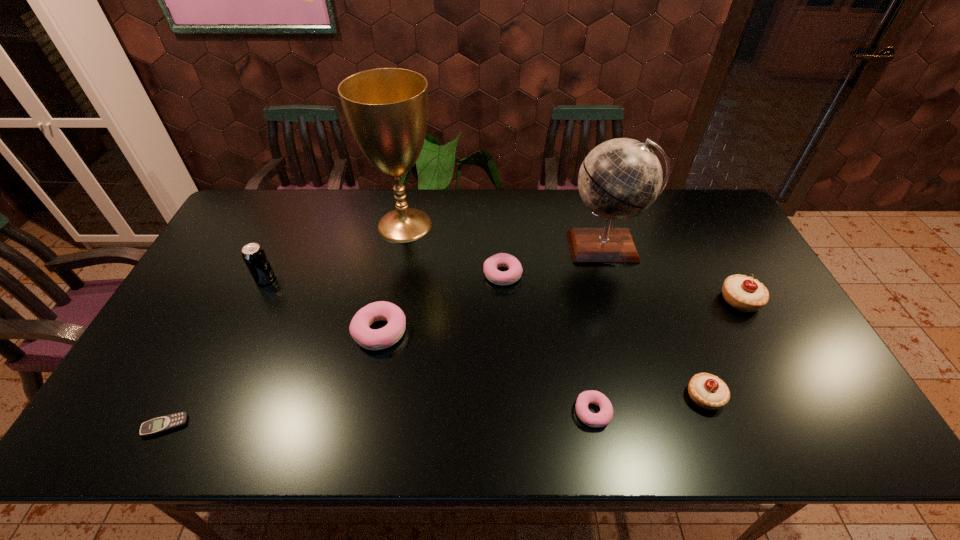
In order to click on vacant area at the far edge in this screenshot , I will do `click(358, 202)`.

I want to click on free space at the left edge of the desktop, so 238,239.

At what (x,y) coordinates should I click in order to perform the action: click on vacant space at the right edge of the desktop. Please return your answer as a coordinate pair (x, y). The width and height of the screenshot is (960, 540). Looking at the image, I should click on (781, 344).

I want to click on free space at the far right corner, so click(680, 212).

This screenshot has height=540, width=960. Find the location of `unoccupied area between the gray beeper and the right beige pastry`. unoccupied area between the gray beeper and the right beige pastry is located at coordinates (453, 363).

Locate an element on the screen. free space between the shortest object and the seventh tallest object is located at coordinates (334, 350).

Identify the location of unoccupied position between the fifth object from right to left and the biggest pink pastry. (442, 303).

Find the location of a particular element. Image resolution: width=960 pixels, height=540 pixels. free space that is in between the nearer beige pastry and the sixth tallest object is located at coordinates (542, 364).

This screenshot has height=540, width=960. What are the coordinates of `empty location between the gray beeper and the soda can` in the screenshot? It's located at (215, 353).

Identify the location of empty space between the soda can and the second tallest object. (435, 263).